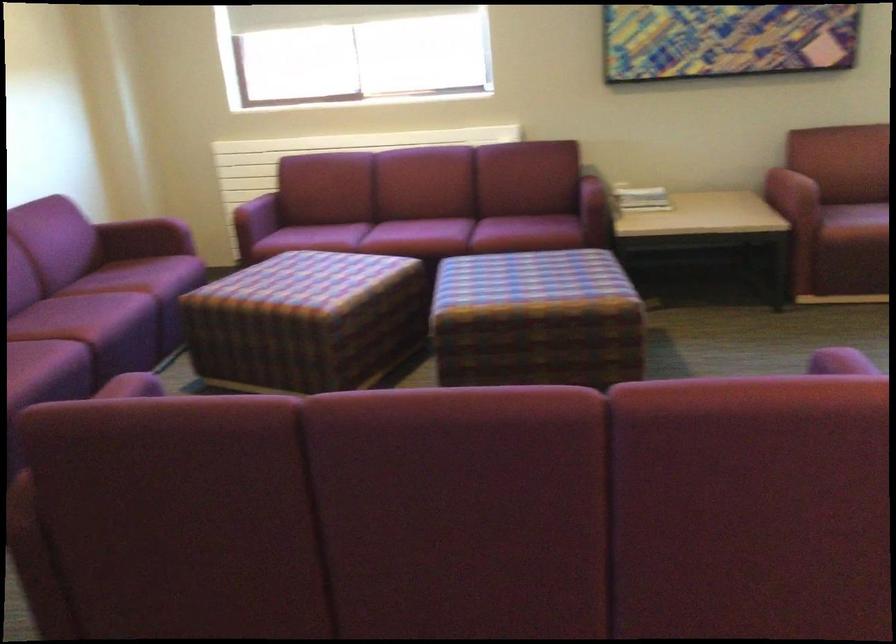
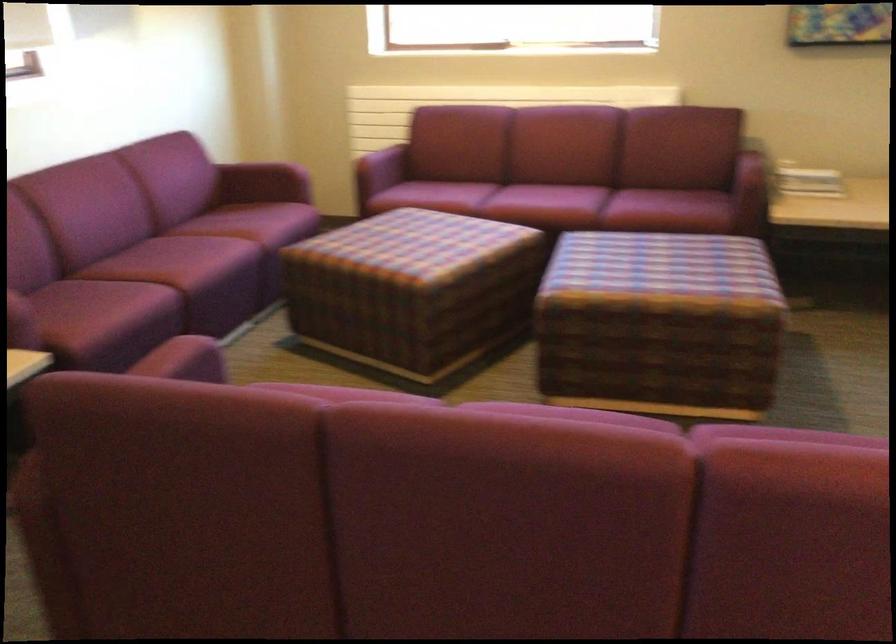
Where in the second image is the point corresponding to [315,319] from the first image?

(412, 289)